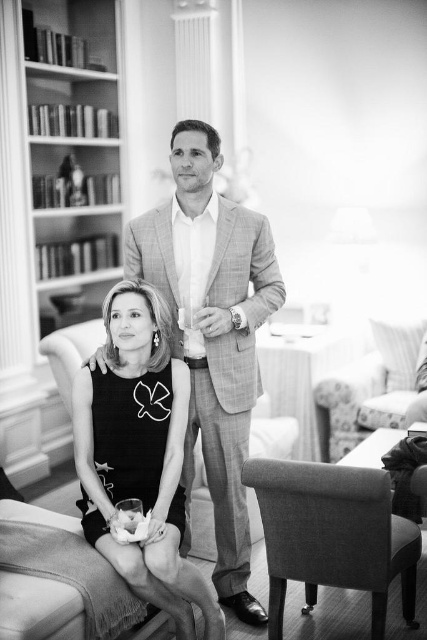
Which is more to the left, plaid fabric suit at center or black fabric armchair at lower left?

plaid fabric suit at center is more to the left.

Does plaid fabric suit at center have a greater width compared to black fabric armchair at lower left?

Yes.

Between point (193, 147) and point (196, 513), which one is positioned behind?

Positioned behind is point (196, 513).

Locate an element on the screen. plaid fabric suit at center is located at coordinates (213, 333).

The height and width of the screenshot is (640, 427). Describe the element at coordinates (73, 154) in the screenshot. I see `wooden bookshelf at left` at that location.

Does point (78, 310) lie behind point (79, 346)?

Yes.

What are the coordinates of `wooden bookshelf at left` in the screenshot? It's located at (73, 154).

In the scene shown: Measure the distance between soft fabric armchair at lower right and camera.

They are 2.38 meters apart.

Who is shorter, soft fabric armchair at lower right or floral fabric armchair at right?

soft fabric armchair at lower right

Which is in front, point (307, 557) or point (417, 342)?

Point (307, 557)

Locate an element on the screen. The width and height of the screenshot is (427, 640). soft fabric armchair at lower right is located at coordinates (333, 536).